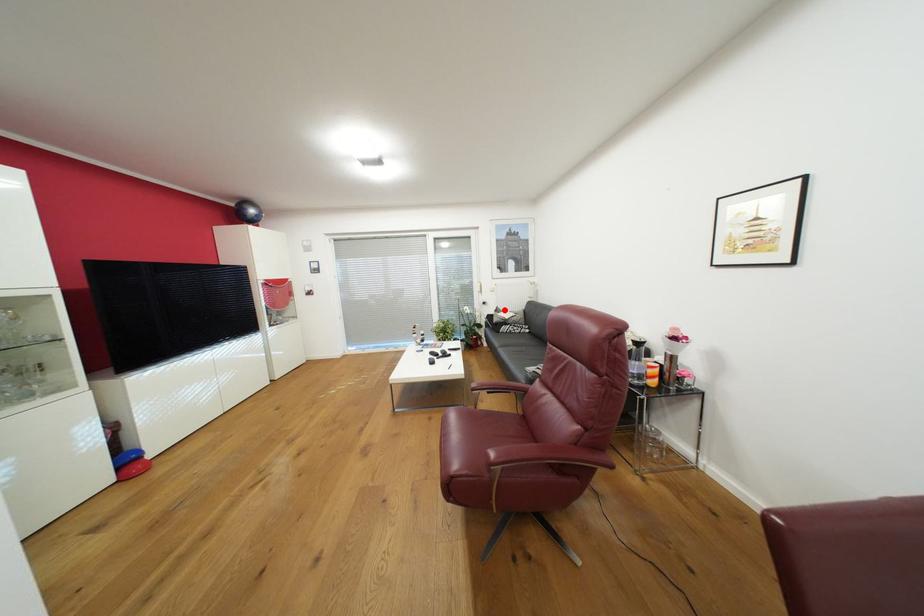
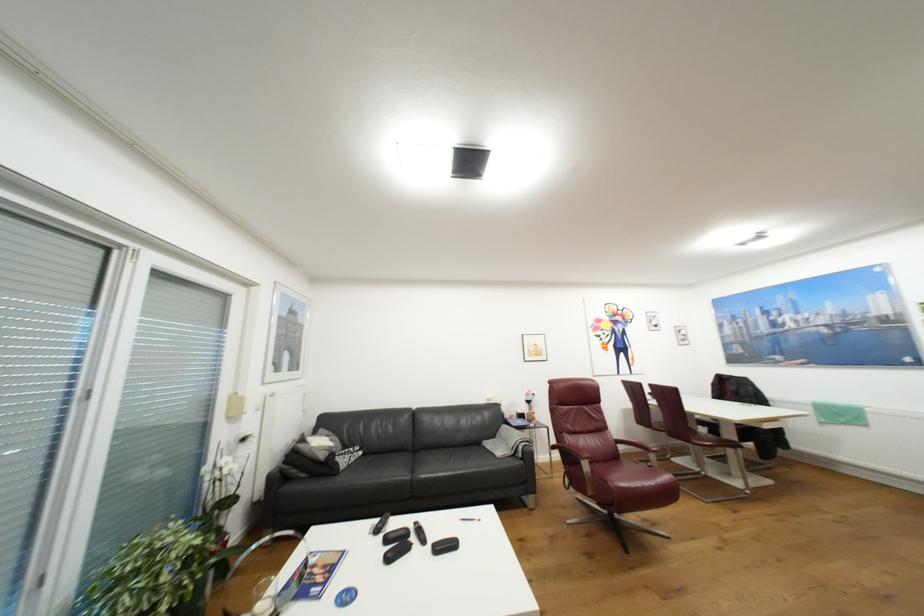
Locate, in the second image, the point that corresponds to the highlighted location in the first image.

(309, 440)